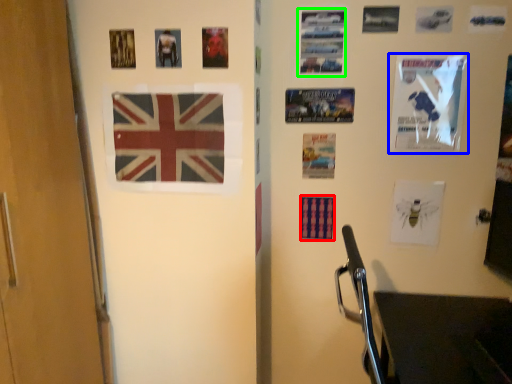
Question: Which object is the farthest from flag (highlighted by a red box)? Choose among these: poster page (highlighted by a blue box) or poster page (highlighted by a green box).

Choices:
 (A) poster page
 (B) poster page

Answer: (B)